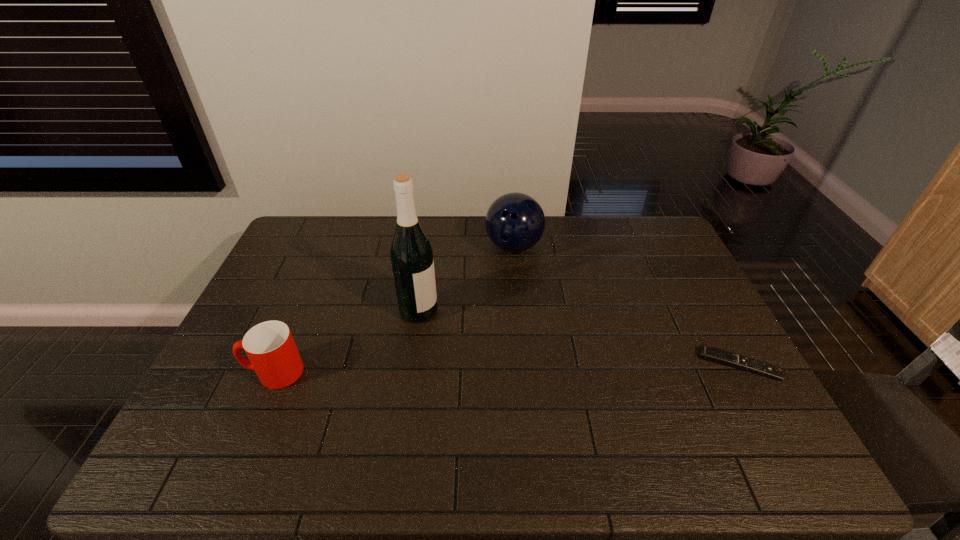
Where is `empty space that is in between the second object from left to right and the leftmost object`? This screenshot has height=540, width=960. empty space that is in between the second object from left to right and the leftmost object is located at coordinates (347, 341).

At what (x,y) coordinates should I click in order to perform the action: click on blank region between the third object from left to right and the shortest object. Please return your answer as a coordinate pair (x, y). The width and height of the screenshot is (960, 540). Looking at the image, I should click on (627, 306).

The image size is (960, 540). Identify the location of vacant area that lies between the remote control and the third object from left to right. (627, 306).

Identify which object is the third nearest to the leftmost object. Please provide its 2D coordinates. Your answer should be formatted as a tuple, i.e. [(x, y)], where the tuple contains the x and y coordinates of a point satisfying the conditions above.

[(708, 353)]

You are a GUI agent. You are given a task and a screenshot of the screen. Output one action in this format:
    pyautogui.click(x=<x>, y=<y>)
    Task: Click on the object identified as the third closest to the wine bottle
    
    Given the screenshot: What is the action you would take?
    pyautogui.click(x=708, y=353)

Locate an element on the screen. This screenshot has height=540, width=960. vacant position in the image that satisfies the following two spatial constraints: 1. on the back side of the wine bottle; 2. on the right side of the second tallest object is located at coordinates click(428, 247).

Identify the location of free space that satisfies the following two spatial constraints: 1. on the back side of the tallest object; 2. on the left side of the bowling ball. The height and width of the screenshot is (540, 960). (428, 247).

This screenshot has width=960, height=540. Find the location of `free spot that satisfies the following two spatial constraints: 1. on the front side of the rightmost object; 2. on the left side of the third object from right to left`. free spot that satisfies the following two spatial constraints: 1. on the front side of the rightmost object; 2. on the left side of the third object from right to left is located at coordinates (411, 364).